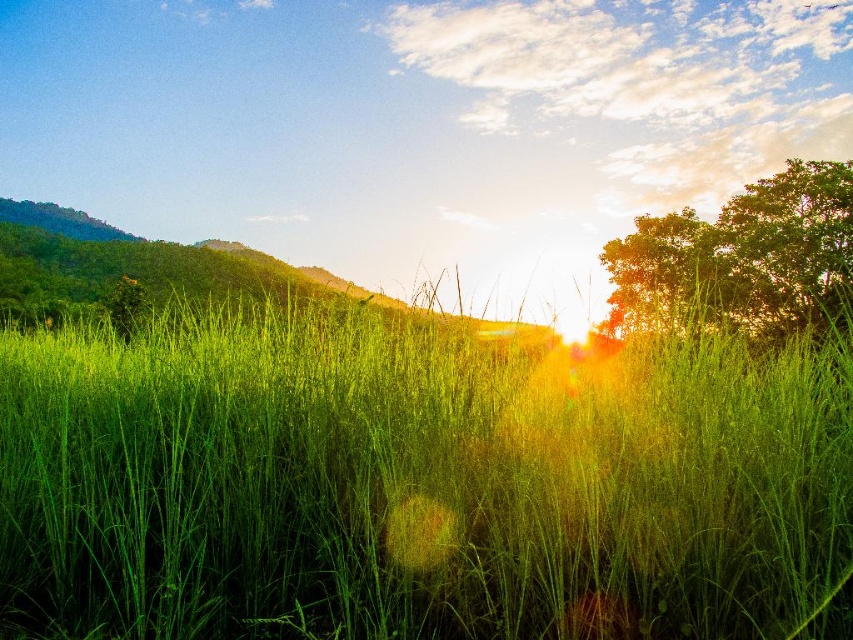
Can you confirm if green grassy at center is taller than green leafy tree at upper right?

Incorrect, green grassy at center's height is not larger of green leafy tree at upper right's.

Is point (669, 499) farther from camera compared to point (784, 204)?

No, (669, 499) is closer to viewer.

Where is `green grassy at center`? The height and width of the screenshot is (640, 853). green grassy at center is located at coordinates (418, 483).

Describe the element at coordinates (418, 483) in the screenshot. I see `green grassy at center` at that location.

Is point (572, 564) more distant than point (154, 257)?

No.

The image size is (853, 640). Identify the location of green grassy at center. (418, 483).

Between green leafy tree at upper right and green grassy hillside at center, which one is positioned higher?

Positioned higher is green grassy hillside at center.

In the scene shown: Does green leafy tree at upper right appear on the right side of green grassy hillside at center?

Correct, you'll find green leafy tree at upper right to the right of green grassy hillside at center.

The image size is (853, 640). What do you see at coordinates (741, 259) in the screenshot?
I see `green leafy tree at upper right` at bounding box center [741, 259].

In order to click on green leafy tree at upper right in this screenshot , I will do `click(741, 259)`.